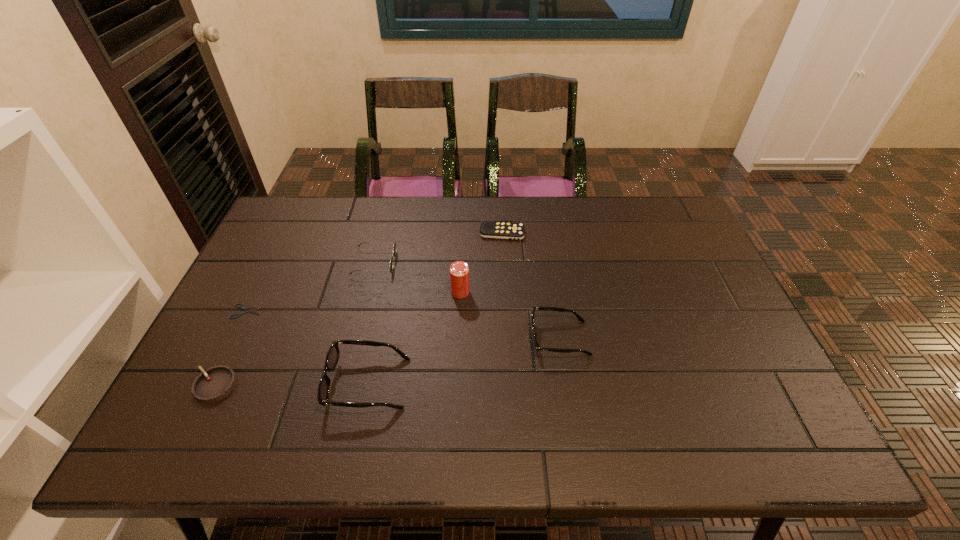
Identify the location of vacant space situated 0.140m on the front-facing side of the second farthest object. The image size is (960, 540). (441, 263).

The image size is (960, 540). What are the coordinates of `free space located 0.280m on the right of the tallest object` in the screenshot? It's located at (568, 292).

Locate an element on the screen. free location located on the right of the ashtray is located at coordinates (282, 386).

You are a GUI agent. You are given a task and a screenshot of the screen. Output one action in this format:
    pyautogui.click(x=<x>, y=<y>)
    Task: Click on the object that is positioned at the far edge
    
    Given the screenshot: What is the action you would take?
    (501, 230)

Where is `spectacles present at the near edge`? The width and height of the screenshot is (960, 540). spectacles present at the near edge is located at coordinates (332, 357).

The image size is (960, 540). I want to click on ashtray located at the near edge, so click(215, 383).

You are a GUI agent. You are given a task and a screenshot of the screen. Output one action in this format:
    pyautogui.click(x=<x>, y=<y>)
    Task: Click on the shears that is positioned at the left edge
    Image resolution: width=960 pixels, height=540 pixels.
    Given the screenshot: What is the action you would take?
    pyautogui.click(x=251, y=311)

Find the location of a particular element. ashtray at the left edge is located at coordinates (215, 383).

Identify the location of object that is at the near left corner. The height and width of the screenshot is (540, 960). (215, 383).

This screenshot has height=540, width=960. I want to click on vacant area at the far edge, so click(526, 201).